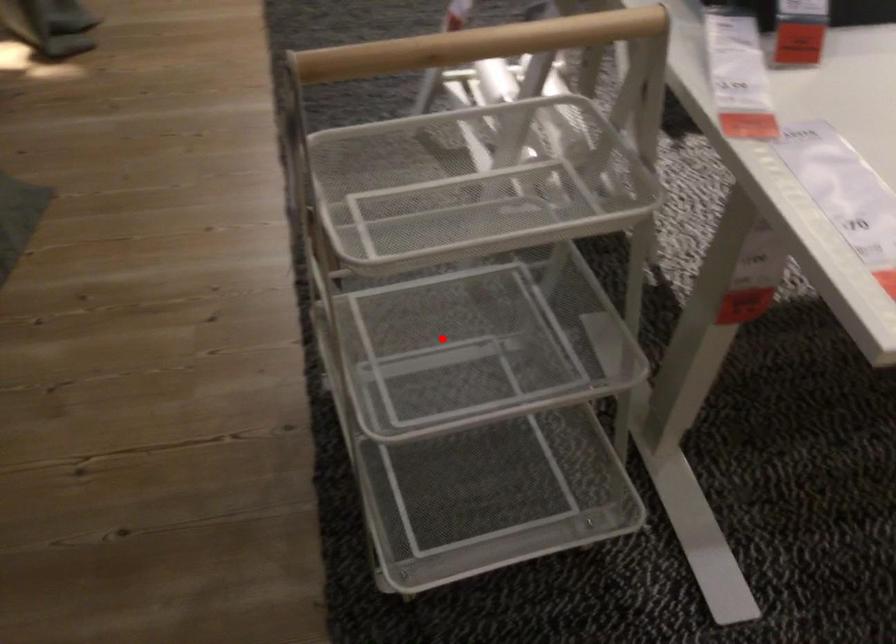
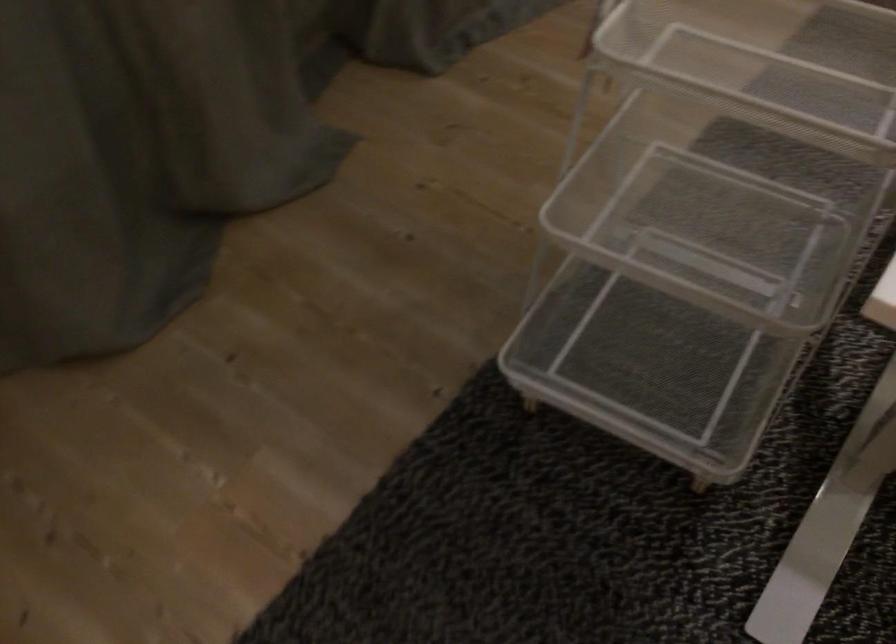
The point at the highlighted location is marked in the first image. Where is the corresponding point in the second image?

(698, 209)